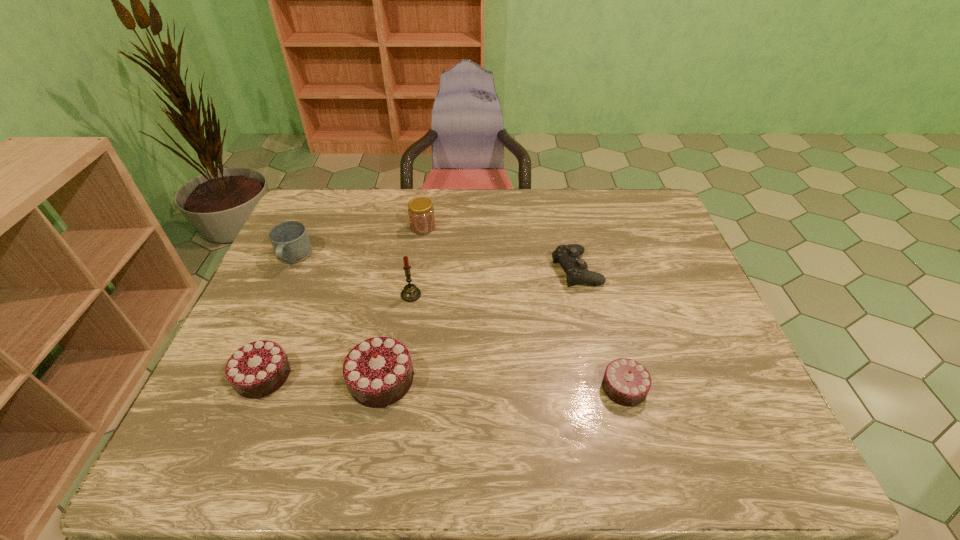
Find the location of a particular element. location for an additional chocolate_cake to make spacing equal is located at coordinates (502, 384).